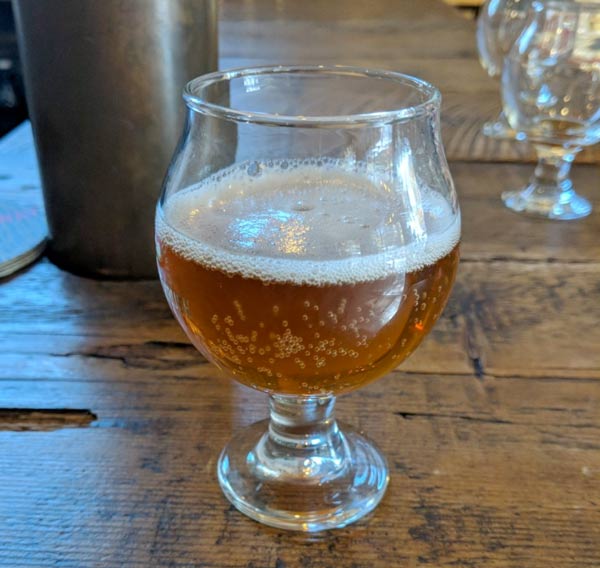
The height and width of the screenshot is (568, 600). In order to click on glass in this screenshot , I will do tap(553, 75), tap(501, 27), tap(327, 229).